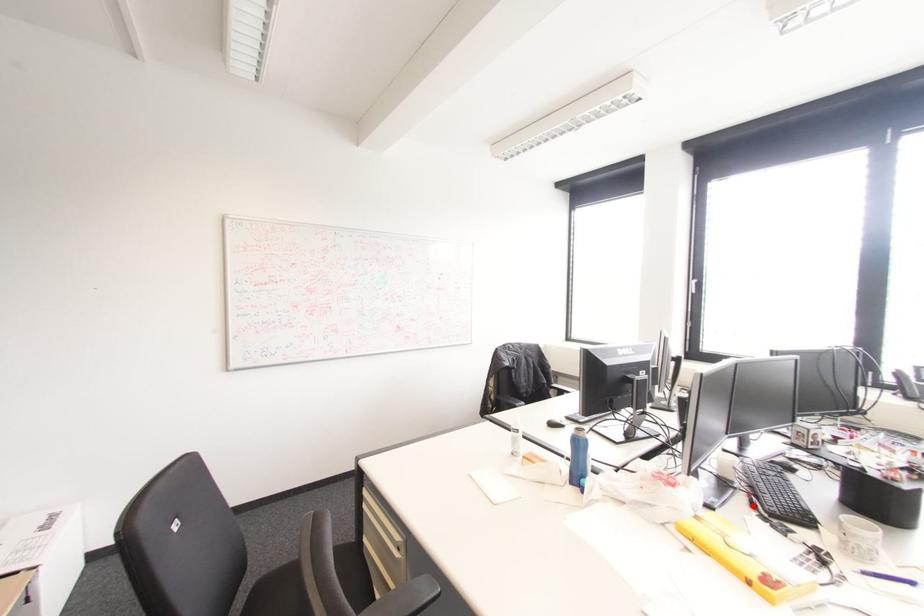
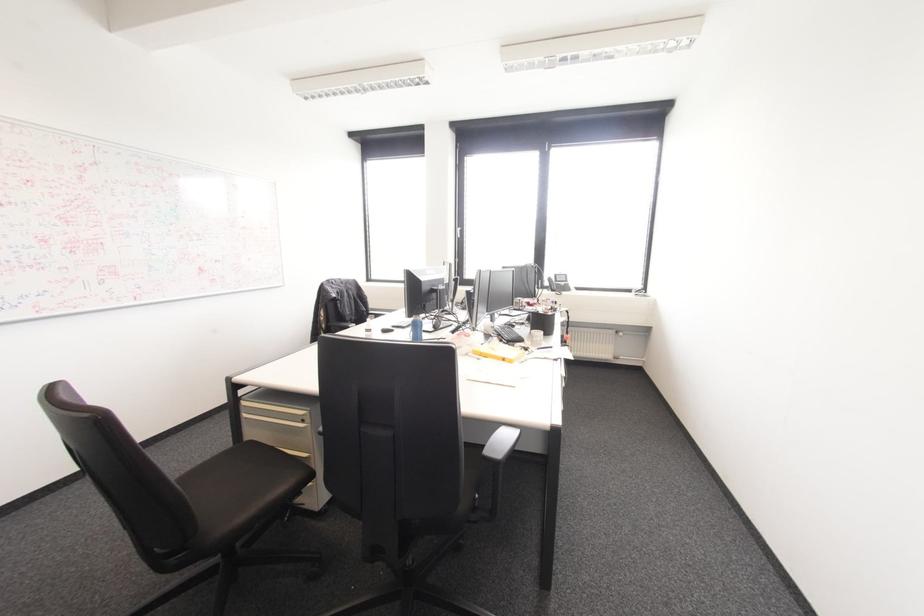
Question: I am providing you with two images of the same scene from different viewpoints. In image1, a red point is highlighted. Considering the same 3D point in image2, which of the following is correct?

Choices:
 (A) It is closer
 (B) It is farther

Answer: (B)